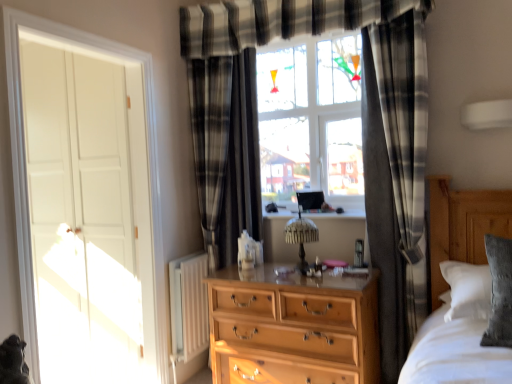
Question: Would you say black plaid curtain at right, the second curtain viewed from the left, is to the left or to the right of white matte door at left in the picture?

Choices:
 (A) right
 (B) left

Answer: (A)

Question: Considering the positions of point (415, 226) and point (121, 316), is point (415, 226) closer or farther from the camera than point (121, 316)?

Choices:
 (A) farther
 (B) closer

Answer: (B)

Question: Which of these objects is positioned closest to the white matte door at left?

Choices:
 (A) black plaid curtain at center, the 1th curtain when ordered from back to front
 (B) silvery fur cat at lower left
 (C) black plaid curtain at right, which is counted as the first curtain, starting from the right

Answer: (A)

Question: Estimate the real-world distances between objects in this image. Which object is farther from the black plaid curtain at center, the 1th curtain viewed from the left?

Choices:
 (A) black plaid curtain at right, the second curtain viewed from the left
 (B) silvery fur cat at lower left
 (C) white matte door at left

Answer: (B)